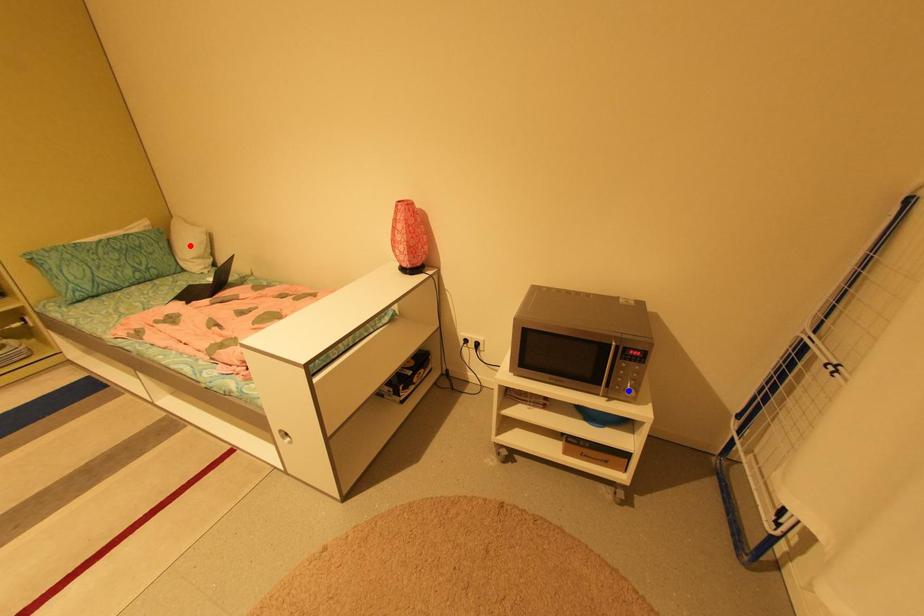
Question: Which of the two points in the image is closer to the camera?

Choices:
 (A) Blue point is closer.
 (B) Red point is closer.

Answer: (A)